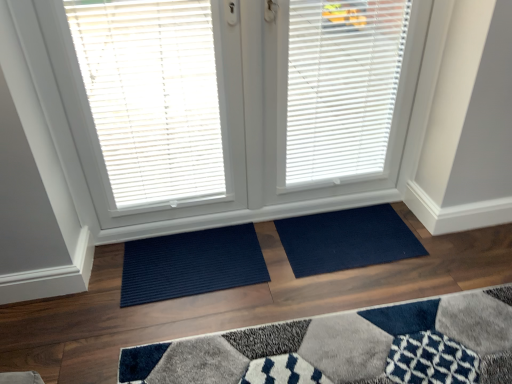
Question: From a real-world perspective, is white matte window blind at center, which ranks as the second window blind in left-to-right order, over navy blue mat at center, which appears as the second doormat when viewed from the left?

Choices:
 (A) yes
 (B) no

Answer: (A)

Question: Can you confirm if white matte window blind at center, which ranks as the second window blind in left-to-right order, is wider than navy blue mat at center, the 1th doormat when ordered from right to left?

Choices:
 (A) yes
 (B) no

Answer: (B)

Question: Is the depth of white matte window blind at center, which ranks as the second window blind in left-to-right order, less than that of navy blue mat at center, the 1th doormat when ordered from right to left?

Choices:
 (A) yes
 (B) no

Answer: (A)

Question: From the image's perspective, is white matte window blind at center, the 1th window blind from the right, under navy blue mat at center, which appears as the second doormat when viewed from the left?

Choices:
 (A) yes
 (B) no

Answer: (B)

Question: Is white matte window blind at center, which ranks as the second window blind in left-to-right order, at the left side of navy blue mat at center, which appears as the second doormat when viewed from the left?

Choices:
 (A) yes
 (B) no

Answer: (A)

Question: From a real-world perspective, is white matte window blind at center, which ranks as the second window blind in left-to-right order, positioned under navy blue mat at center, the 1th doormat when ordered from right to left, based on gravity?

Choices:
 (A) yes
 (B) no

Answer: (B)

Question: Does navy blue textured mat at lower center, marked as the 2th doormat in a right-to-left arrangement, have a greater height compared to white plastic blinds at upper left, which ranks as the second window blind in right-to-left order?

Choices:
 (A) yes
 (B) no

Answer: (B)

Question: From the image's perspective, would you say navy blue textured mat at lower center, marked as the 2th doormat in a right-to-left arrangement, is positioned over white plastic blinds at upper left, which appears as the first window blind when viewed from the left?

Choices:
 (A) no
 (B) yes

Answer: (A)

Question: Considering the relative sizes of navy blue textured mat at lower center, marked as the 2th doormat in a right-to-left arrangement, and white plastic blinds at upper left, which appears as the first window blind when viewed from the left, in the image provided, is navy blue textured mat at lower center, marked as the 2th doormat in a right-to-left arrangement, bigger than white plastic blinds at upper left, which appears as the first window blind when viewed from the left,?

Choices:
 (A) no
 (B) yes

Answer: (A)

Question: Can white plastic blinds at upper left, which appears as the first window blind when viewed from the left, be found inside navy blue textured mat at lower center, which is counted as the first doormat, starting from the left?

Choices:
 (A) no
 (B) yes

Answer: (A)

Question: Is navy blue textured mat at lower center, which is counted as the first doormat, starting from the left, further to the viewer compared to white plastic blinds at upper left, which appears as the first window blind when viewed from the left?

Choices:
 (A) no
 (B) yes

Answer: (B)

Question: Is navy blue textured mat at lower center, marked as the 2th doormat in a right-to-left arrangement, next to white plastic blinds at upper left, which appears as the first window blind when viewed from the left?

Choices:
 (A) no
 (B) yes

Answer: (A)

Question: Is navy blue textured mat at lower center, which is counted as the first doormat, starting from the left, at the back of white plastic blinds at upper left, which ranks as the second window blind in right-to-left order?

Choices:
 (A) no
 (B) yes

Answer: (A)